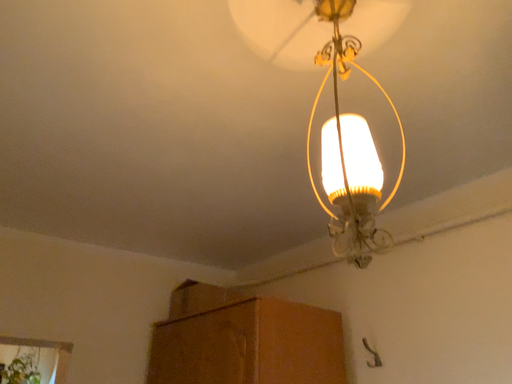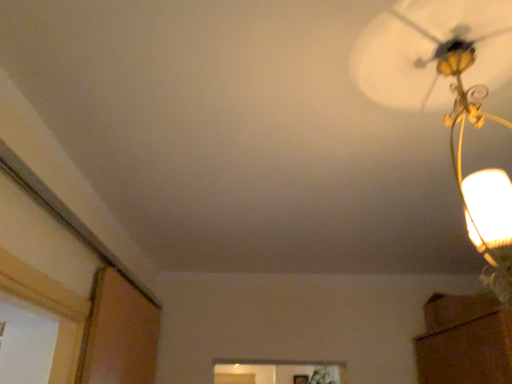
Question: How did the camera likely rotate when shooting the video?

Choices:
 (A) rotated right
 (B) rotated left

Answer: (B)